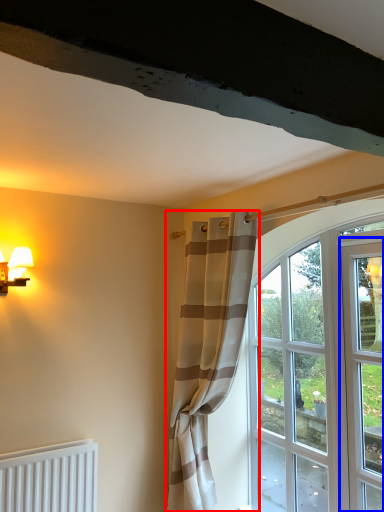
Question: Which point is further to the camera, curtain (highlighted by a red box) or screen door (highlighted by a blue box)?

Choices:
 (A) curtain
 (B) screen door

Answer: (A)